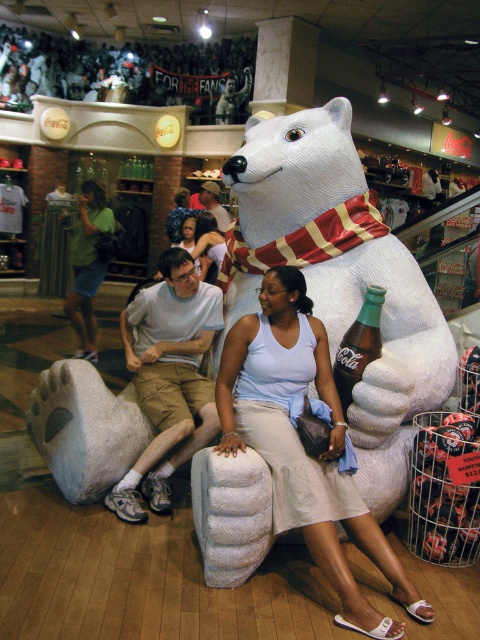
You are a photographer trying to capture a photo of the Coca Cola display with the two people sitting on the bear. You want to ensure both the green fabric shirt at left and the light brown fabric shirt at center are clearly visible in the frame. Based on their positions, which shirt should you focus on first to ensure both are in focus?

The green fabric shirt at left is located below the light brown fabric shirt at center. To ensure both are in focus, you should focus on the light brown fabric shirt at center first since it is higher up, allowing the depth of field to naturally include the lower positioned green fabric shirt at left.

In the scene shown: You are a photographer standing in the shopping mall and want to take a picture of the green fabric shirt at left and the light brown fabric shirt at center. If your camera can capture objects within a 5 feet range, will both shirts be in focus?

The green fabric shirt at left is 4.83 feet away from the light brown fabric shirt at center. Since the distance between them is within the 5 feet range, both shirts will be in focus in the photograph.

You are standing in the shopping mall and see the white matte polar bear at center and the light brown fabric shirt at center. Which object is positioned closer to you?

The white matte polar bear at center is closer to the viewer than the light brown fabric shirt at center.